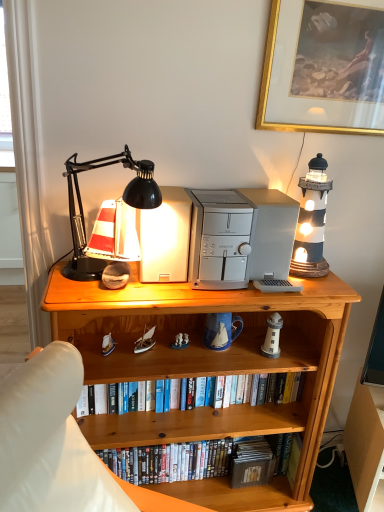
What are the coordinates of `vacant space underneath black matte desk lamp at upper left (from a real-world perspective)` in the screenshot? It's located at (116, 293).